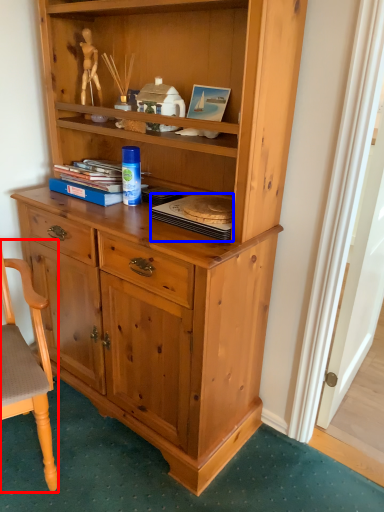
Question: Which object appears farthest to the camera in this image, chair (highlighted by a red box) or book (highlighted by a blue box)?

Choices:
 (A) chair
 (B) book

Answer: (B)